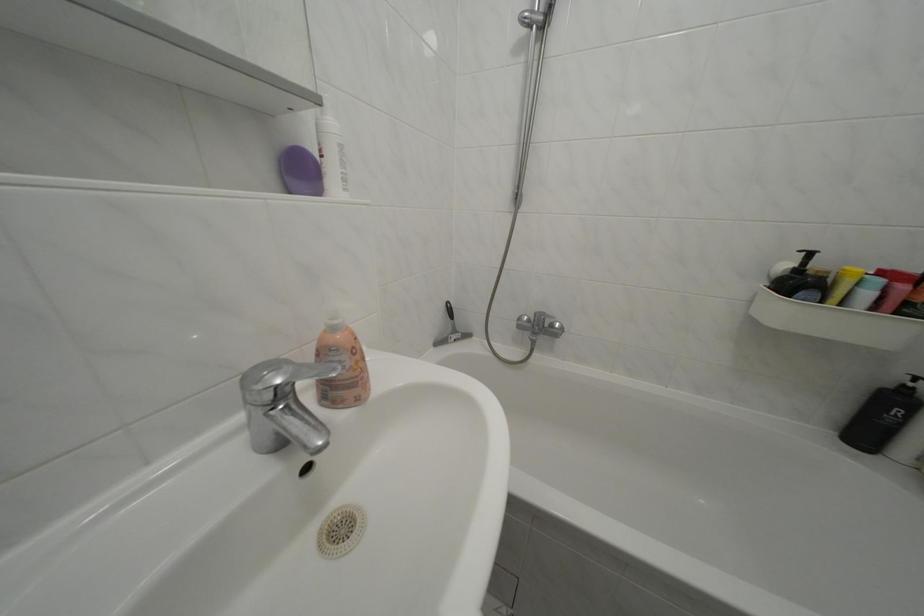
This screenshot has height=616, width=924. Describe the element at coordinates (280, 379) in the screenshot. I see `the silver faucet handle` at that location.